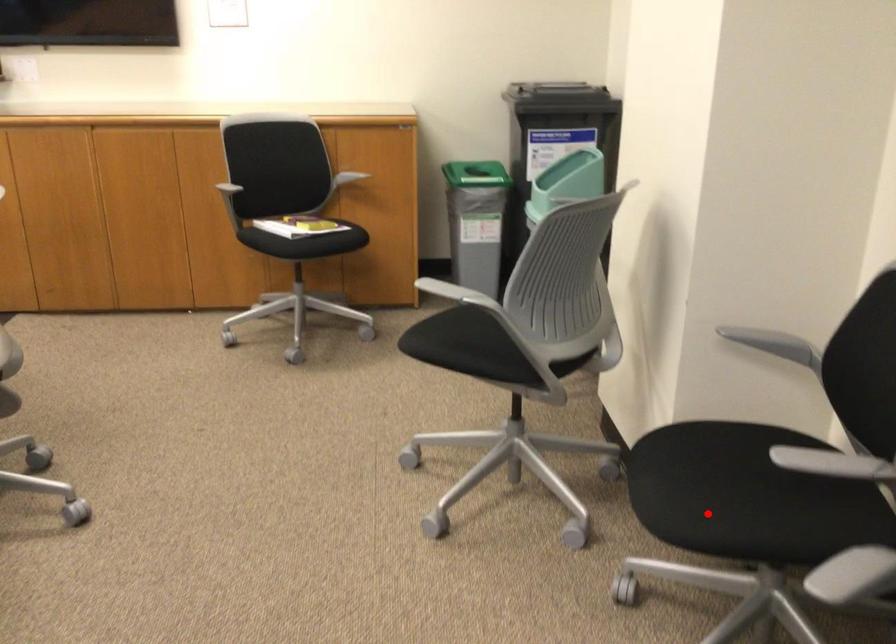
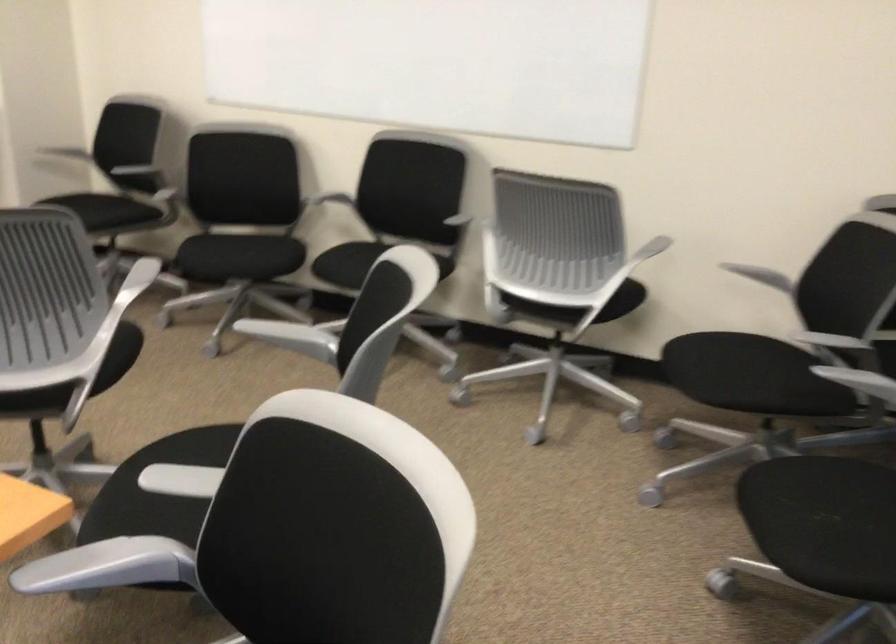
Find the pixel in the second image that matches the highlighted location in the first image.

(97, 213)